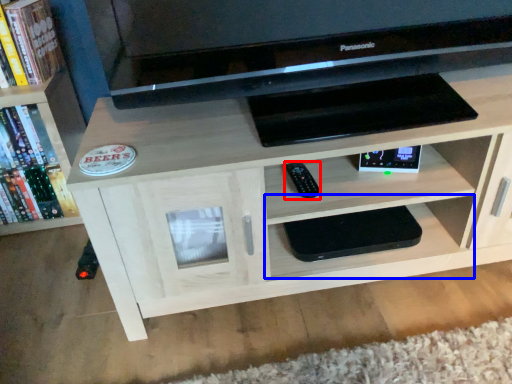
Question: Which object appears farthest to the camera in this image, remote (highlighted by a red box) or shelf (highlighted by a blue box)?

Choices:
 (A) remote
 (B) shelf

Answer: (B)